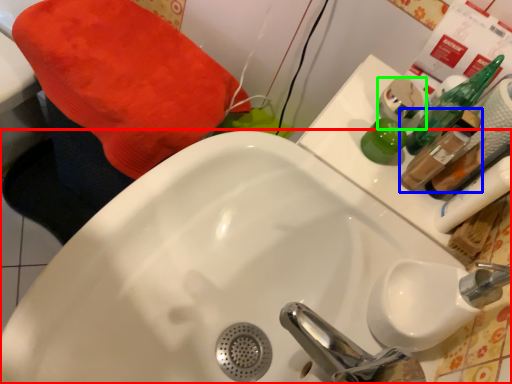
Question: Based on their relative distances, which object is farther from sink (highlighted by a red box)? Choose from mouthwash (highlighted by a blue box) and mouthwash (highlighted by a green box).

Choices:
 (A) mouthwash
 (B) mouthwash

Answer: (B)